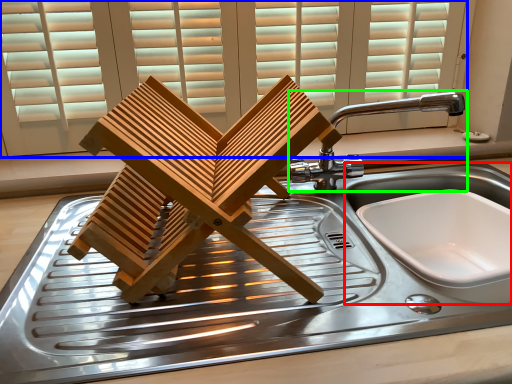
Question: Which object is positioned closest to sink (highlighted by a red box)? Select from window (highlighted by a blue box) and tap (highlighted by a green box).

Choices:
 (A) window
 (B) tap

Answer: (B)